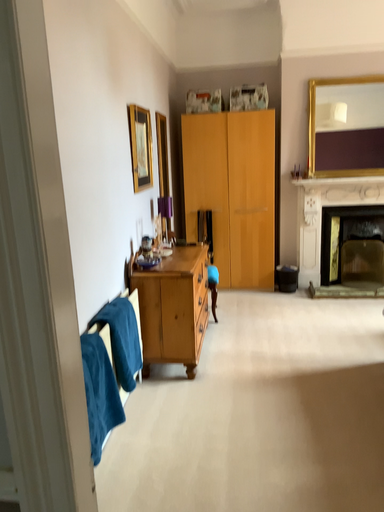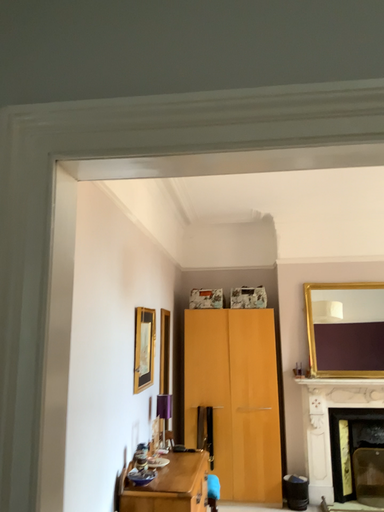
Question: How did the camera likely rotate when shooting the video?

Choices:
 (A) rotated upward
 (B) rotated downward

Answer: (A)